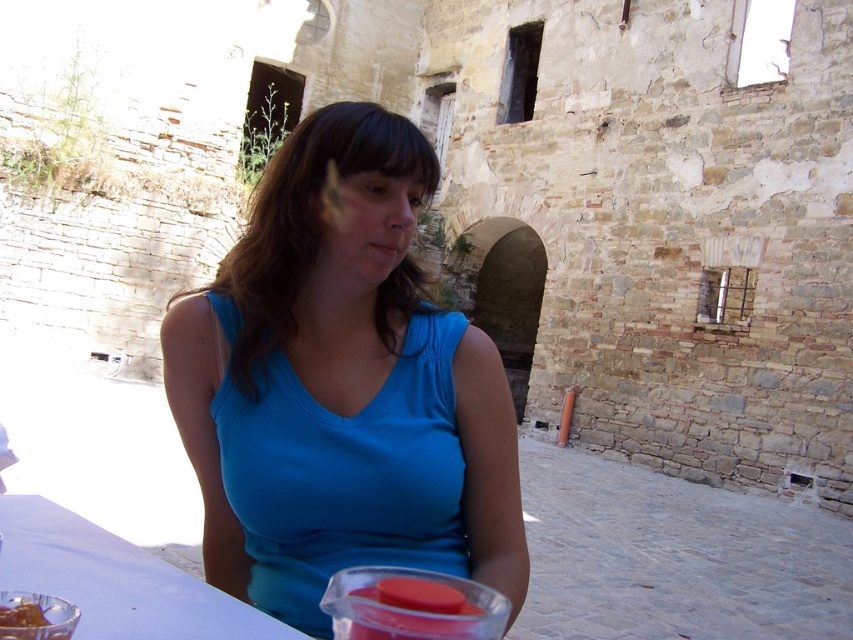
Is white matte table at lower left thinner than shiny brown chocolate at lower left?

Yes.

The width and height of the screenshot is (853, 640). Describe the element at coordinates (115, 580) in the screenshot. I see `white matte table at lower left` at that location.

You are a GUI agent. You are given a task and a screenshot of the screen. Output one action in this format:
    pyautogui.click(x=<x>, y=<y>)
    Task: Click on the white matte table at lower left
    
    Given the screenshot: What is the action you would take?
    pyautogui.click(x=115, y=580)

Is the position of translucent plastic cup at lower center more distant than that of shiny brown chocolate at lower left?

Yes, it is.

Locate an element on the screen. Image resolution: width=853 pixels, height=640 pixels. translucent plastic cup at lower center is located at coordinates (410, 605).

Which is behind, point (268, 272) or point (57, 625)?

Positioned behind is point (268, 272).

Between point (479, 339) and point (1, 620), which one is positioned in front?

Point (1, 620) is more forward.

Between point (245, 486) and point (62, 636), which one is positioned in front?

Point (62, 636) is more forward.

What are the coordinates of `blue fabric shirt at center` in the screenshot? It's located at (341, 385).